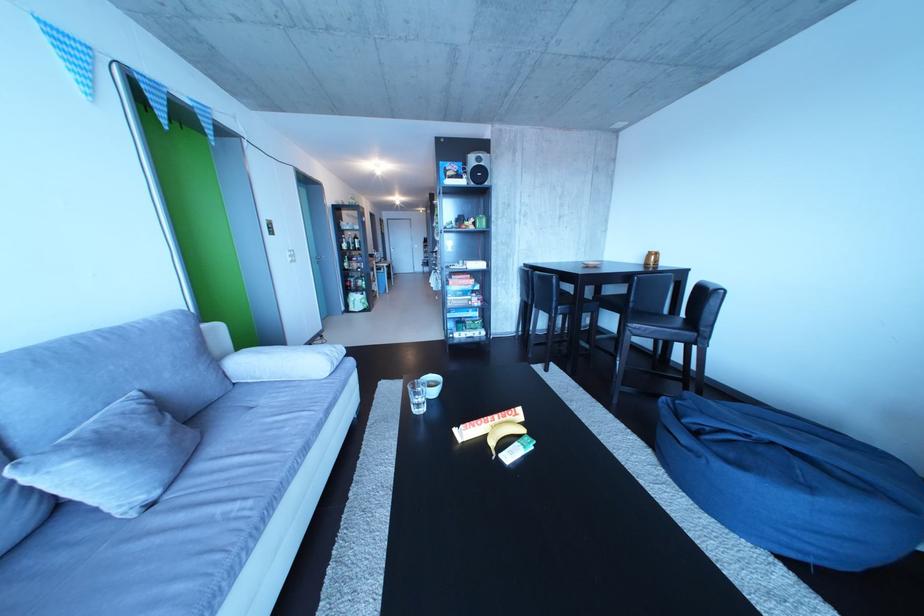
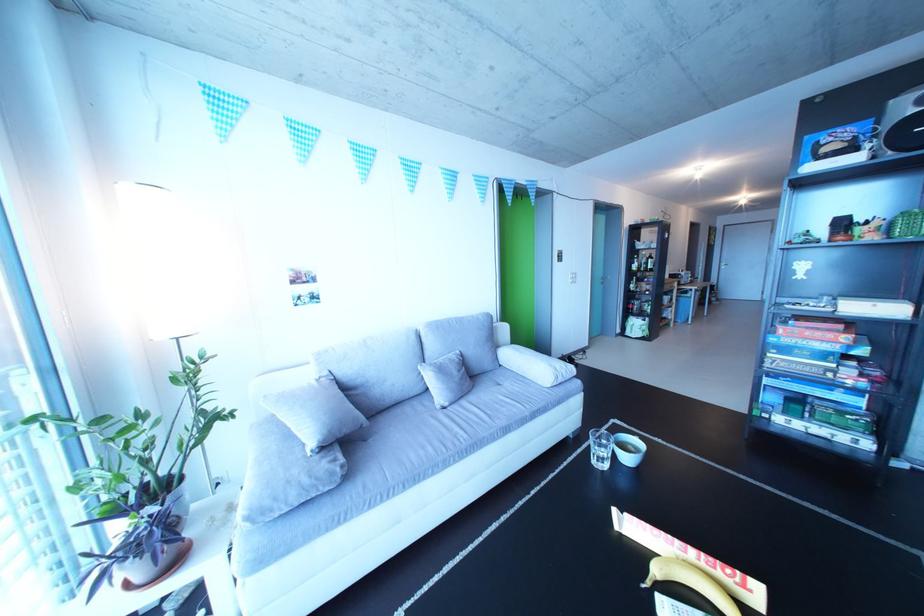
Question: I am providing you with two images of the same scene from different viewpoints. After the viewpoint changes to image2, which objects are now occluded?

Choices:
 (A) red board game box
 (B) sofa sitting surface
 (C) blue board game box
 (D) none of these

Answer: (D)